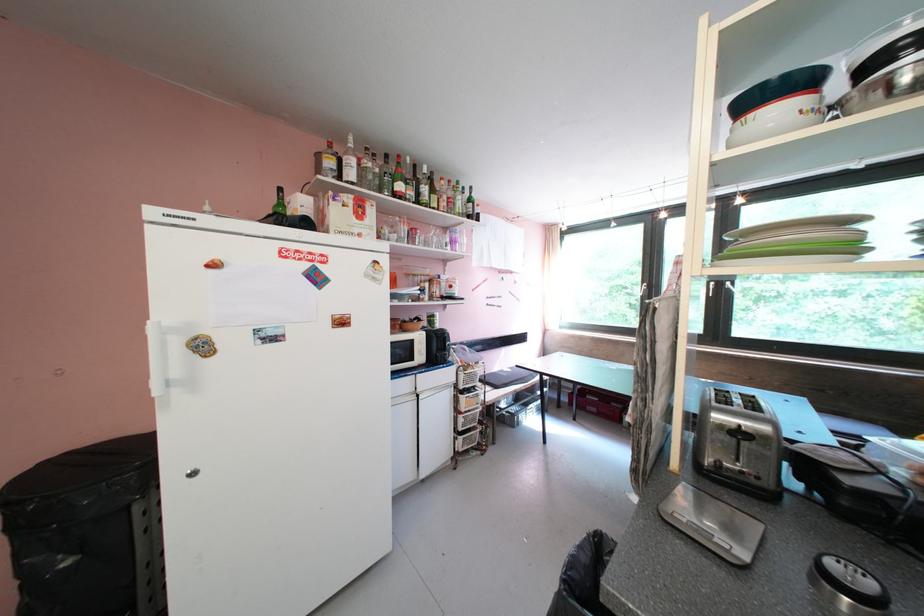
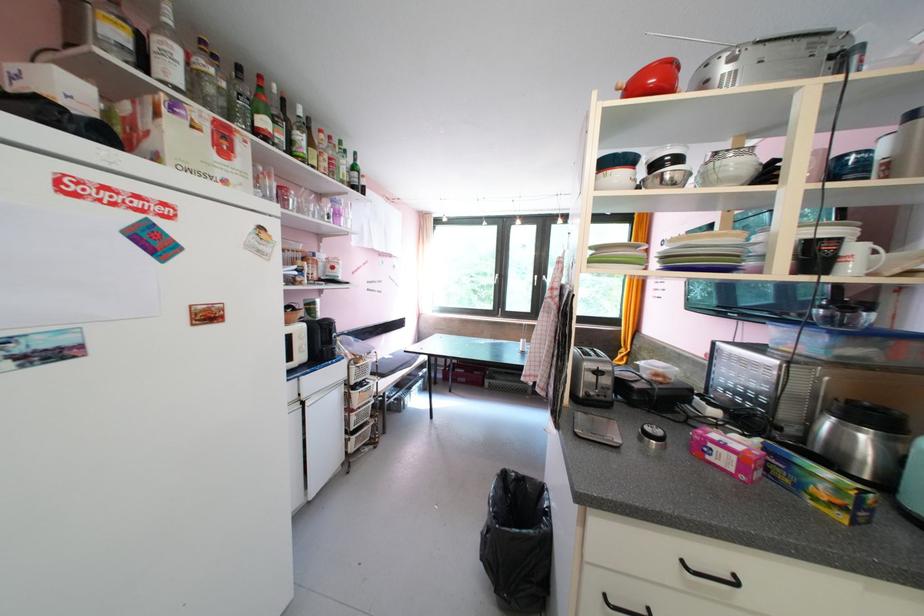
Find the pixel in the second image that matches [385,172] in the first image.

(233, 86)